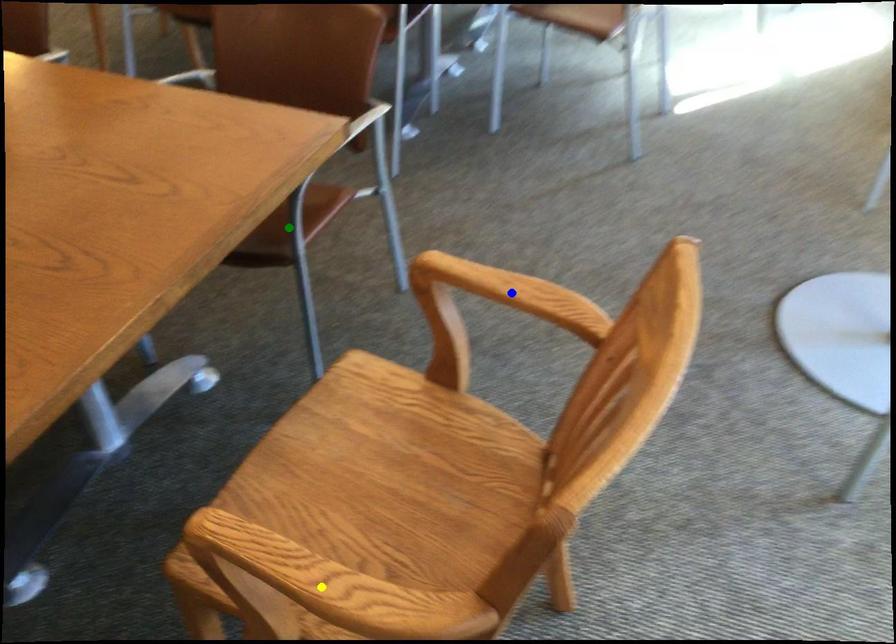
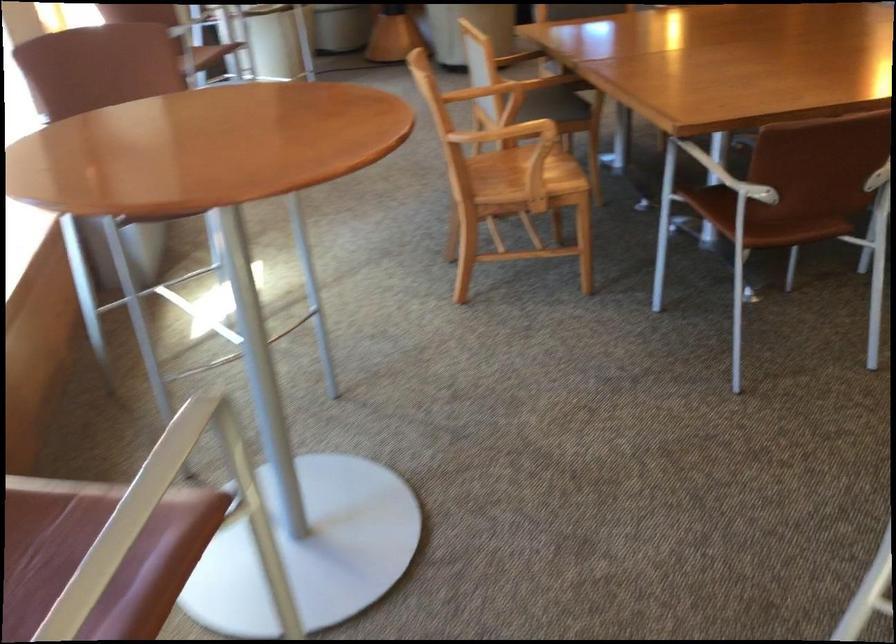
I am providing you with two images of the same scene from different viewpoints. Three points are marked in image1. Which point corresponds to a part or object that is occluded in image2?In image1, three points are marked. Which of them correspond to a part or object that is occluded in image2?Among the three points shown in image1, which one corresponds to a part or object that is no longer visible due to occlusion in image2?

blue point, yellow point, green point